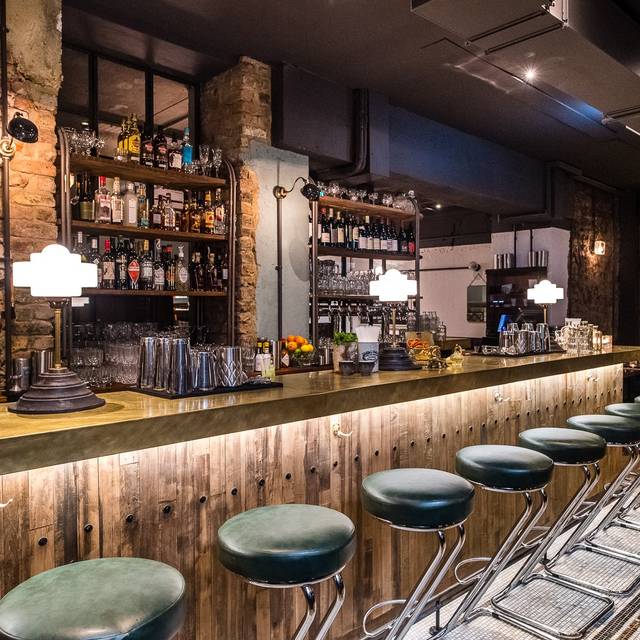
You are a GUI agent. You are given a task and a screenshot of the screen. Output one action in this format:
    pyautogui.click(x=<x>, y=<y>)
    Task: Click on the barstools
    This screenshot has height=640, width=640.
    Given the screenshot: What is the action you would take?
    pyautogui.click(x=114, y=596), pyautogui.click(x=296, y=534), pyautogui.click(x=419, y=483), pyautogui.click(x=521, y=451), pyautogui.click(x=580, y=436), pyautogui.click(x=603, y=428), pyautogui.click(x=621, y=408)